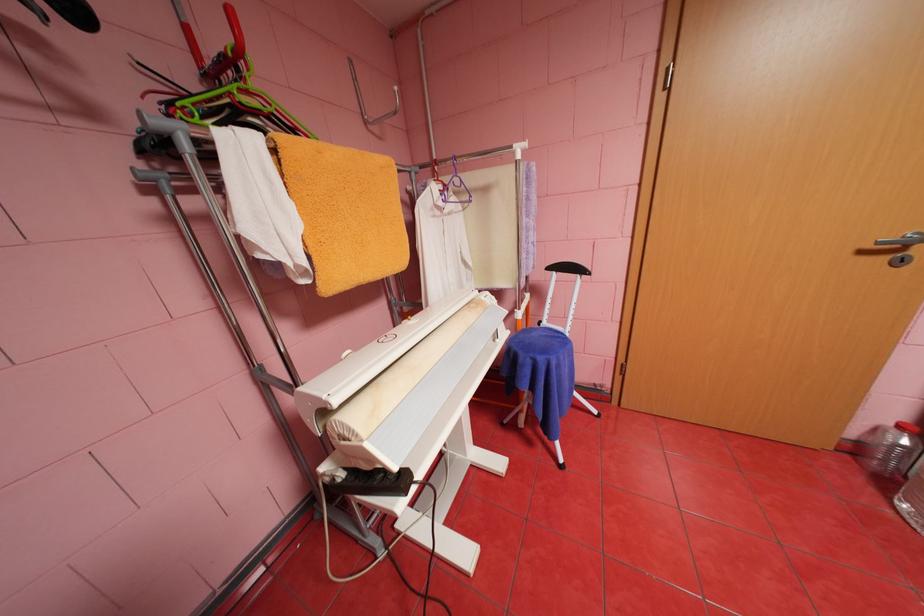
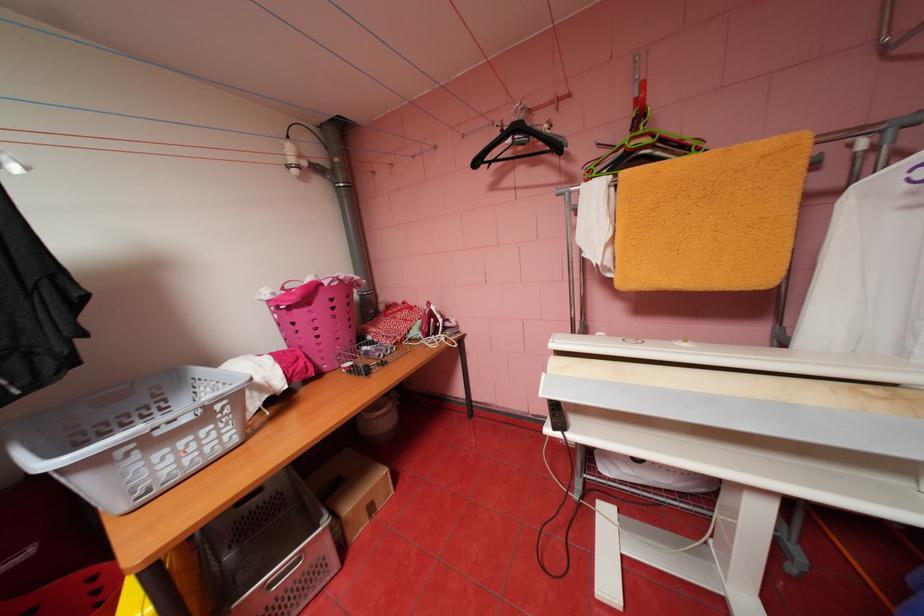
From the picture: The first image is from the beginning of the video and the second image is from the end. How did the camera likely rotate when shooting the video?

The camera rotated toward left-down.